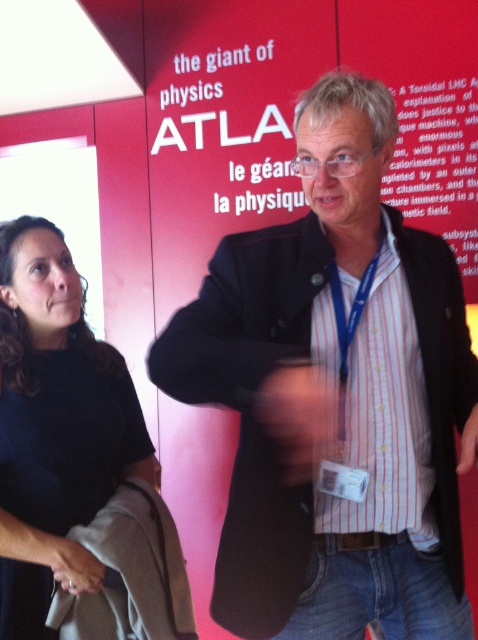
Question: Which point is closer to the camera?

Choices:
 (A) (41, 323)
 (B) (380, 358)

Answer: (B)

Question: Which object is farther from the camera taking this photo?

Choices:
 (A) black matte shirt at upper left
 (B) striped cotton shirt at center

Answer: (A)

Question: Is striped cotton shirt at center positioned in front of black matte shirt at upper left?

Choices:
 (A) no
 (B) yes

Answer: (B)

Question: Can you confirm if striped cotton shirt at center is positioned below black matte shirt at upper left?

Choices:
 (A) yes
 (B) no

Answer: (B)

Question: Which point is closer to the camera?

Choices:
 (A) black matte shirt at upper left
 (B) striped cotton shirt at center

Answer: (B)

Question: Does striped cotton shirt at center have a smaller size compared to black matte shirt at upper left?

Choices:
 (A) no
 (B) yes

Answer: (A)